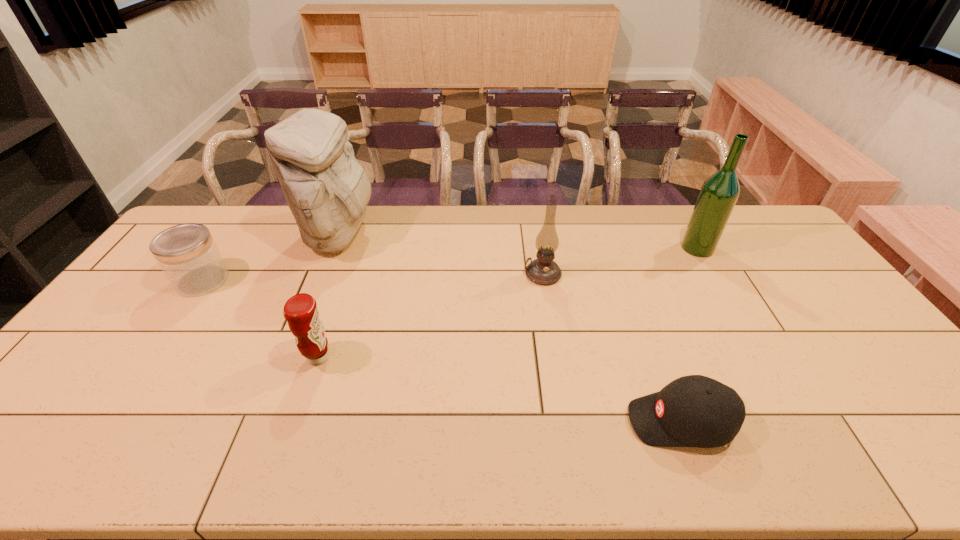
The width and height of the screenshot is (960, 540). I want to click on vacant space that satisfies the following two spatial constraints: 1. on the front-facing side of the fourth tallest object; 2. on the right side of the backpack, so click(291, 357).

The image size is (960, 540). I want to click on vacant position in the image that satisfies the following two spatial constraints: 1. on the front-facing side of the backpack; 2. on the right side of the rightmost object, so click(x=334, y=248).

You are a GUI agent. You are given a task and a screenshot of the screen. Output one action in this format:
    pyautogui.click(x=<x>, y=<y>)
    Task: Click on the blank space that satisfies the following two spatial constraints: 1. on the front-facing side of the rightmost object; 2. on the right side of the backpack
    
    Given the screenshot: What is the action you would take?
    click(x=334, y=248)